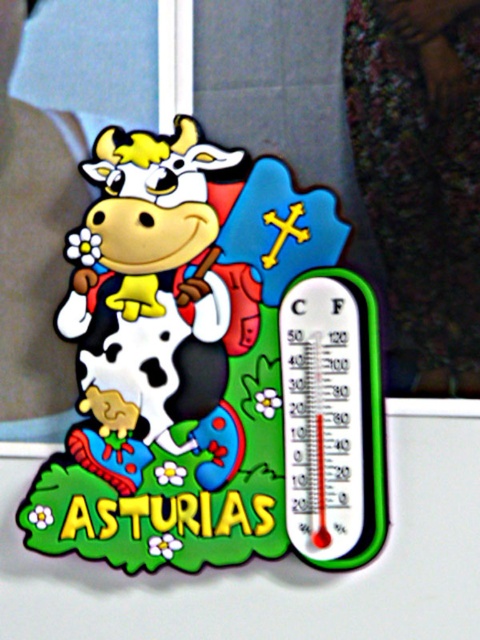
Who is positioned more to the left, matte plastic cow at center or transparent plastic thermometer at right?

From the viewer's perspective, matte plastic cow at center appears more on the left side.

Who is more forward, (301, 294) or (310, 342)?

Point (310, 342) is more forward.

Locate an element on the screen. matte plastic cow at center is located at coordinates (213, 369).